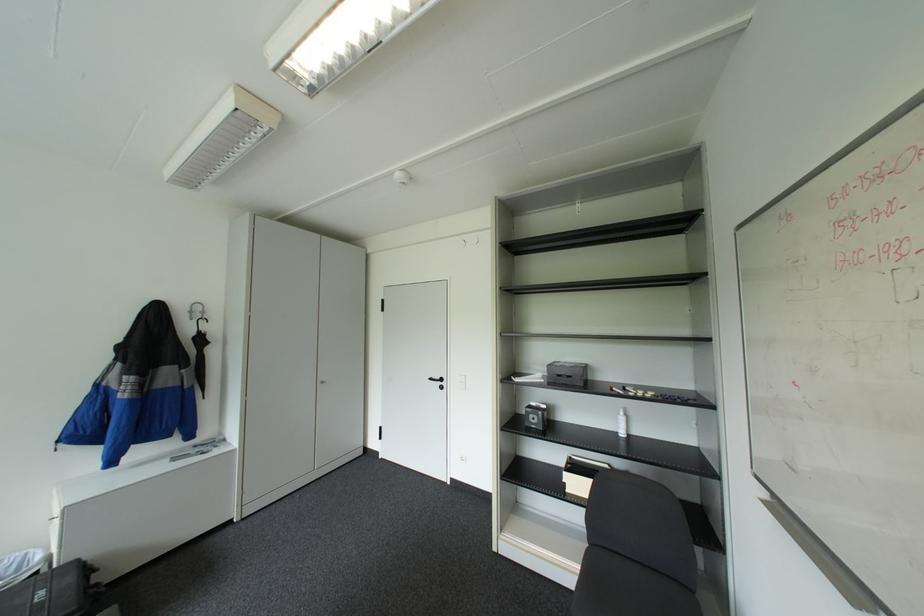
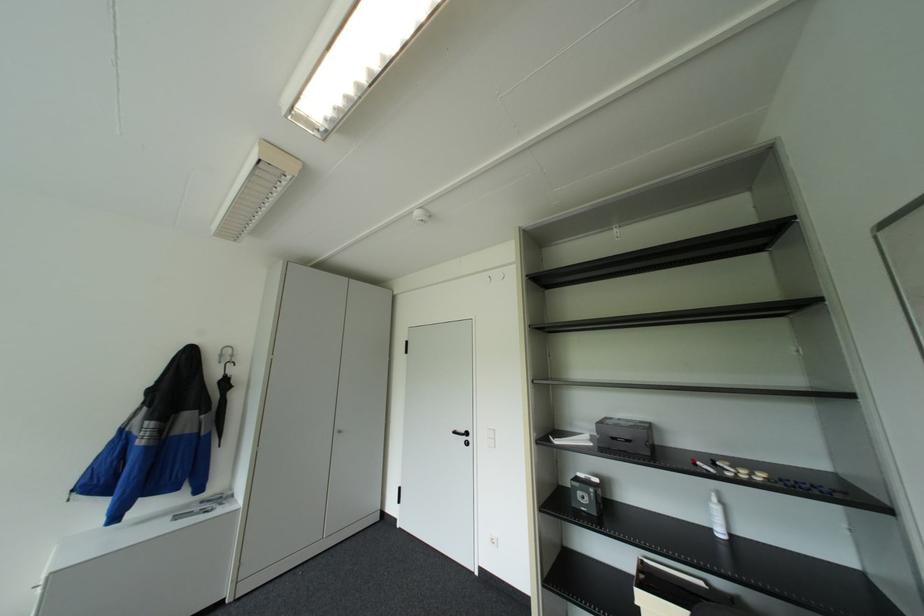
Where in the second image is the point corresponding to [628,434] from the first image?

(725, 533)